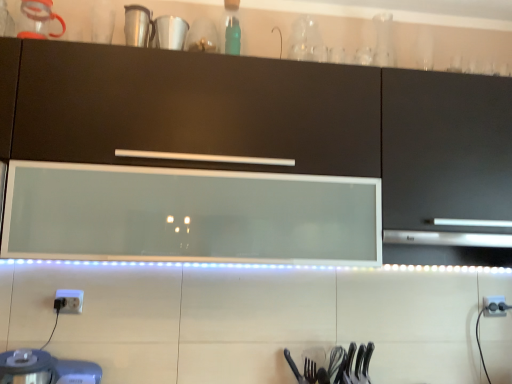
Question: Considering the positions of white glossy cup at upper center and white plastic electric outlet at lower right, which ranks as the 1th electric outlet in back-to-front order, in the image, is white glossy cup at upper center taller or shorter than white plastic electric outlet at lower right, which ranks as the 1th electric outlet in back-to-front order,?

Choices:
 (A) tall
 (B) short

Answer: (A)

Question: From the image's perspective, is white glossy cup at upper center positioned above or below white plastic electric outlet at lower right, the first electric outlet in the bottom-to-top sequence?

Choices:
 (A) above
 (B) below

Answer: (A)

Question: Which object is the closest to the polished metal fork at lower center?

Choices:
 (A) white plastic electric outlet at lower right, which ranks as the 1th electric outlet in back-to-front order
 (B) white glossy cup at upper center
 (C) transparent glass range hood at center
 (D) matte black cabinet at center
 (E) white plastic electric outlet at lower left, the first electric outlet positioned from the left

Answer: (C)

Question: Estimate the real-world distances between objects in this image. Which object is farther from the white plastic electric outlet at lower right, which is the second electric outlet from front to back?

Choices:
 (A) metallic silver blender at lower left
 (B) white glossy cup at upper center
 (C) polished metal fork at lower center
 (D) white plastic electric outlet at lower left, placed as the first electric outlet when sorted from front to back
 (E) transparent glass range hood at center

Answer: (A)